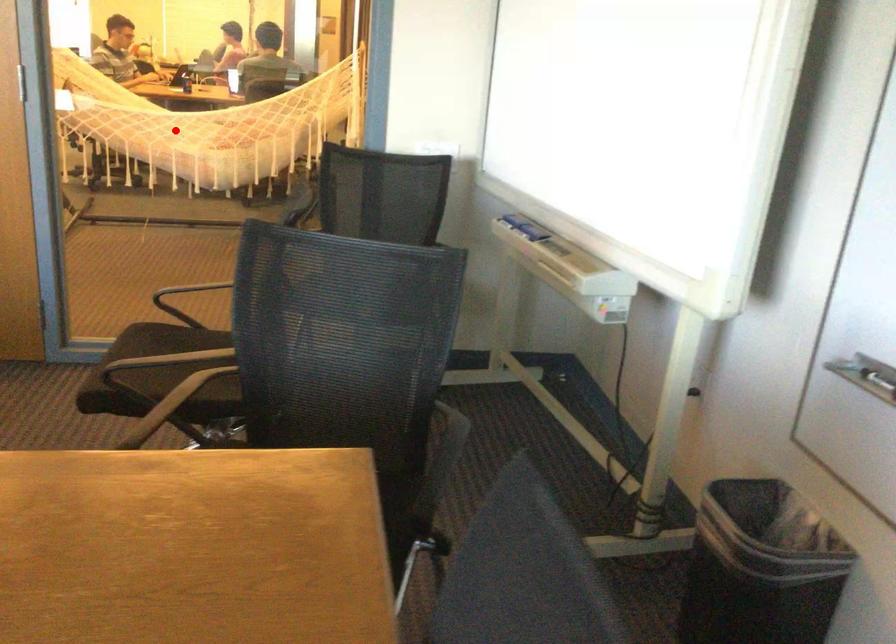
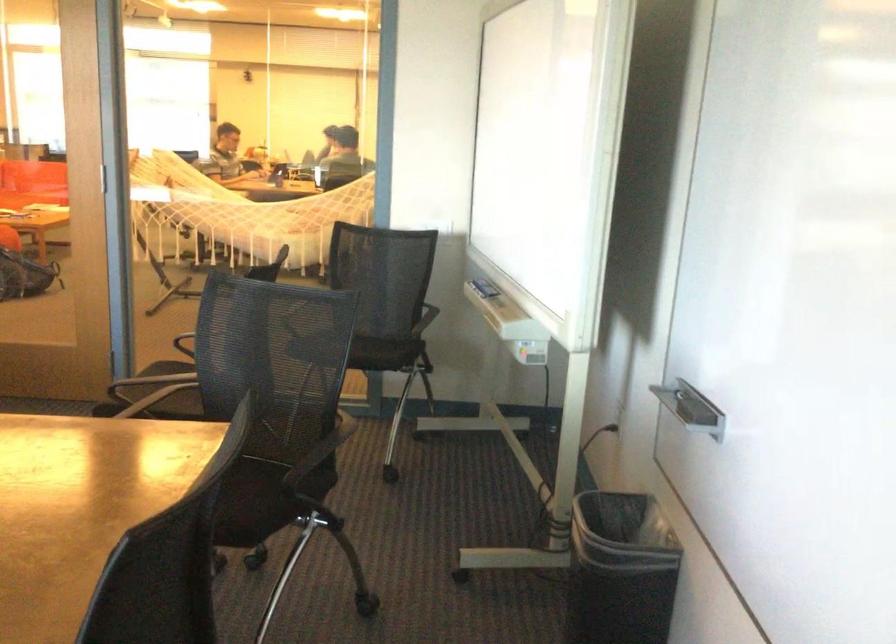
Question: I am providing you with two images of the same scene from different viewpoints. Image1 has a red point marked. In image2, the corresponding 3D location appears at what relative position? Reply with the corresponding letter.

Choices:
 (A) Closer
 (B) Farther

Answer: (B)